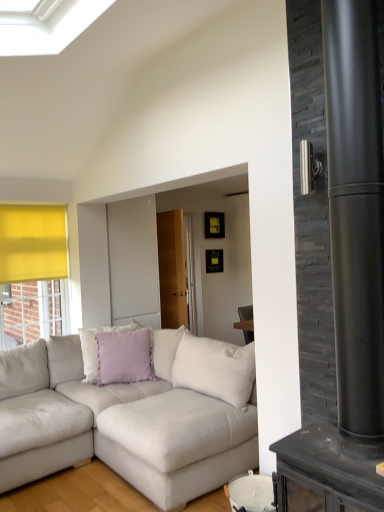
Question: Visually, is matte black fireplace at right positioned to the left or to the right of lavender fabric pillow at center?

Choices:
 (A) left
 (B) right

Answer: (B)

Question: Choose the correct answer: Is matte black fireplace at right inside lavender fabric pillow at center or outside it?

Choices:
 (A) outside
 (B) inside

Answer: (A)

Question: Considering the real-world distances, which object is farthest from the lavender fabric pillow at center?

Choices:
 (A) light gray fabric couch at lower left
 (B) matte black fireplace at right

Answer: (B)

Question: Which is nearer to the matte black fireplace at right?

Choices:
 (A) light gray fabric couch at lower left
 (B) lavender fabric pillow at center

Answer: (A)